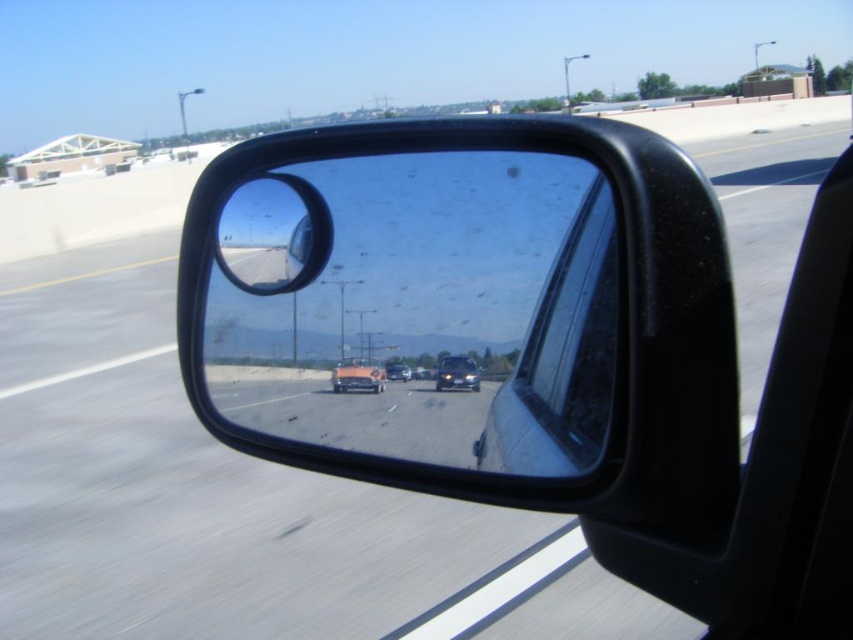
Question: Which is nearer to the clear plastic mirror at center?

Choices:
 (A) shiny orange car at center
 (B) glossy black car at center

Answer: (A)

Question: Is clear plastic mirror at center positioned in front of glossy black car at center?

Choices:
 (A) yes
 (B) no

Answer: (A)

Question: In this image, where is shiny orange car at center located relative to shiny metallic sedan at center?

Choices:
 (A) above
 (B) below

Answer: (B)

Question: Which point is farther to the camera?

Choices:
 (A) (543, 305)
 (B) (453, 360)
 (C) (402, 368)

Answer: (C)

Question: Which point is farther from the camera taking this photo?

Choices:
 (A) (403, 371)
 (B) (236, 221)
 (C) (459, 380)

Answer: (B)

Question: Does clear plastic mirror at center have a lesser width compared to shiny metallic sedan at center?

Choices:
 (A) no
 (B) yes

Answer: (A)